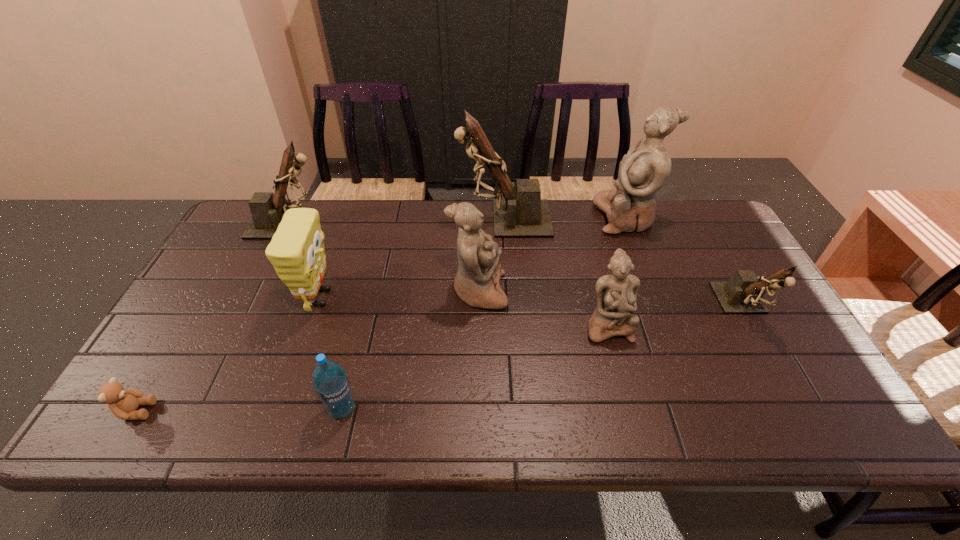
Locate an element on the screen. The width and height of the screenshot is (960, 540). free space between the water bottle and the leftmost figurine is located at coordinates coord(315,316).

Locate an element on the screen. The height and width of the screenshot is (540, 960). vacant space that's between the second brown figurine from left to right and the fourth object from left to right is located at coordinates (423, 314).

Image resolution: width=960 pixels, height=540 pixels. I want to click on vacant area between the second brown figurine from left to right and the leftmost figurine, so 396,221.

You are a GUI agent. You are given a task and a screenshot of the screen. Output one action in this format:
    pyautogui.click(x=<x>, y=<y>)
    Task: Click on the free area in between the second biggest brown figurine and the shortest object
    
    Given the screenshot: What is the action you would take?
    pyautogui.click(x=213, y=318)

At what (x,y) coordinates should I click in order to perform the action: click on free space between the smallest white figurine and the sponge. Please return your answer as a coordinate pair (x, y). The image size is (960, 540). Looking at the image, I should click on [x=464, y=312].

Find the location of a particular element. The height and width of the screenshot is (540, 960). vacant area between the second biggest brown figurine and the biggest brown figurine is located at coordinates [x=396, y=221].

Identify which object is located as the second nearest to the smallest white figurine. Please provide its 2D coordinates. Your answer should be formatted as a tuple, i.e. [(x, y)], where the tuple contains the x and y coordinates of a point satisfying the conditions above.

[(743, 293)]

Point out which object is positioned as the fourth nearest to the smallest white figurine. Please provide its 2D coordinates. Your answer should be formatted as a tuple, i.e. [(x, y)], where the tuple contains the x and y coordinates of a point satisfying the conditions above.

[(644, 170)]

You are a GUI agent. You are given a task and a screenshot of the screen. Output one action in this format:
    pyautogui.click(x=<x>, y=<y>)
    Task: Click on the figurine identified as the second closest to the third object from left to right
    The height and width of the screenshot is (540, 960).
    Given the screenshot: What is the action you would take?
    pyautogui.click(x=477, y=280)

Select which figurine appears as the fifth closest to the shortest object. Please provide its 2D coordinates. Your answer should be formatted as a tuple, i.e. [(x, y)], where the tuple contains the x and y coordinates of a point satisfying the conditions above.

[(644, 170)]